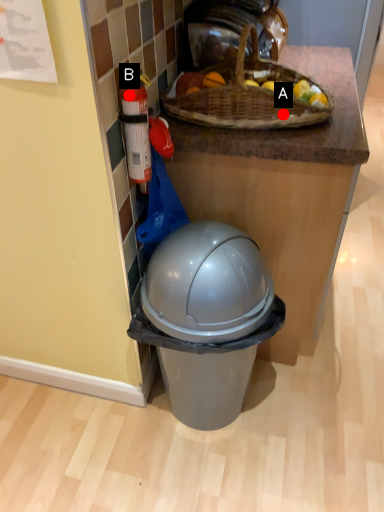
Question: Two points are circled on the image, labeled by A and B beside each circle. Which point appears farthest from the camera in this image?

Choices:
 (A) A is further
 (B) B is further

Answer: (A)